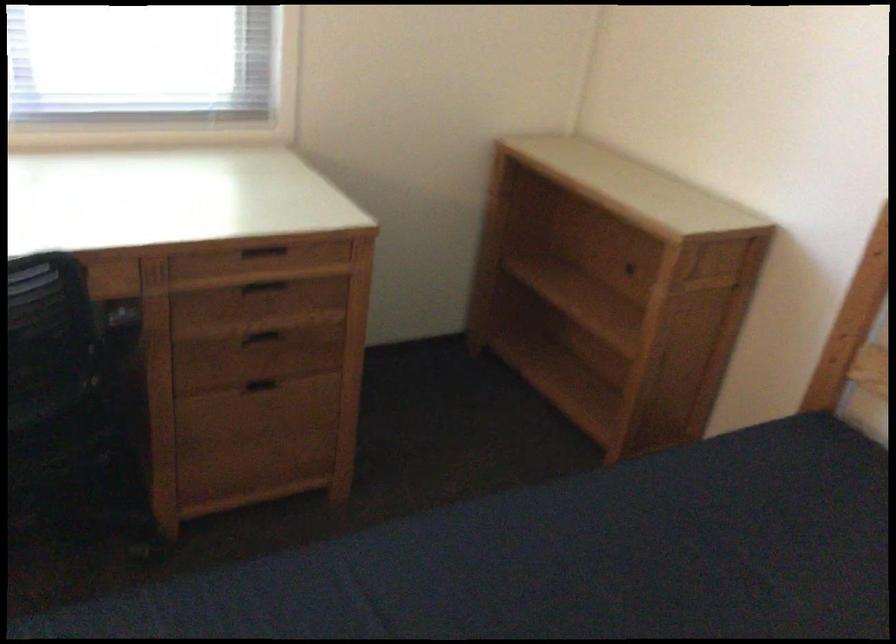
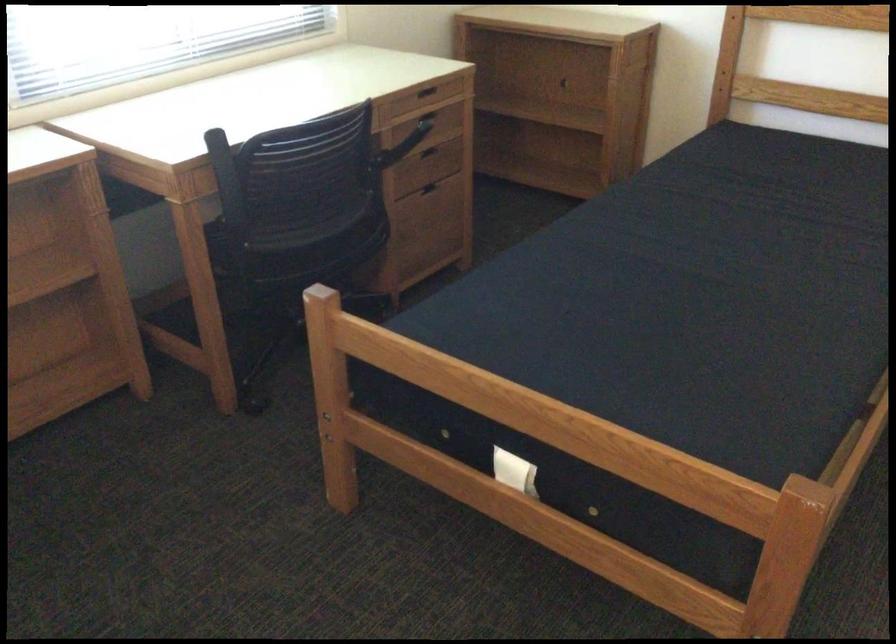
The point at (264, 393) is marked in the first image. Where is the corresponding point in the second image?

(434, 192)